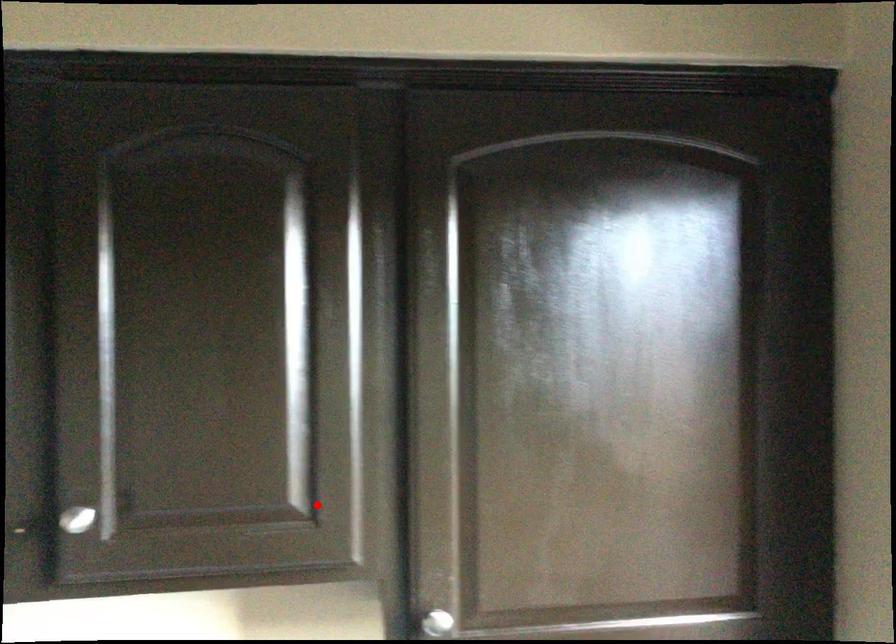
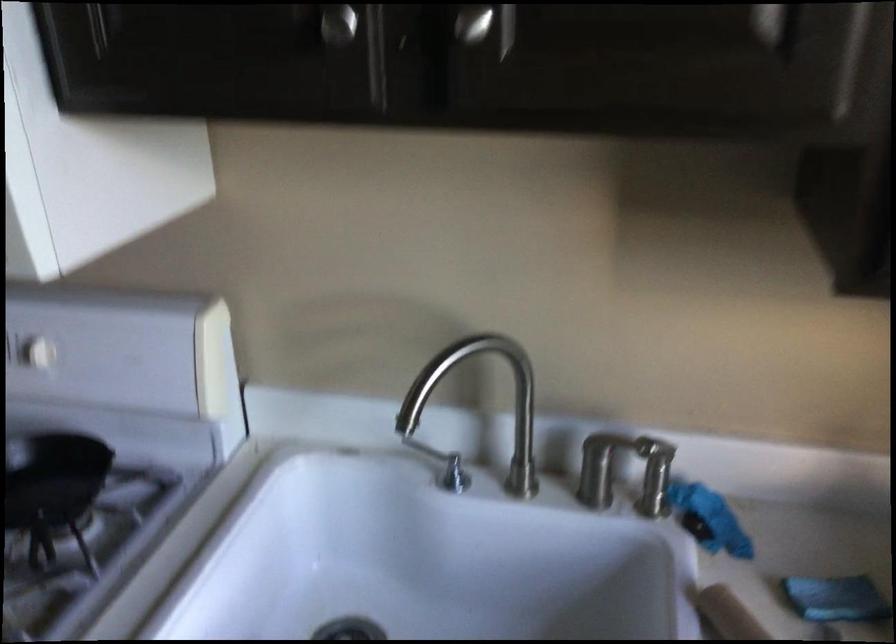
The point at the highlighted location is marked in the first image. Where is the corresponding point in the second image?

(794, 24)